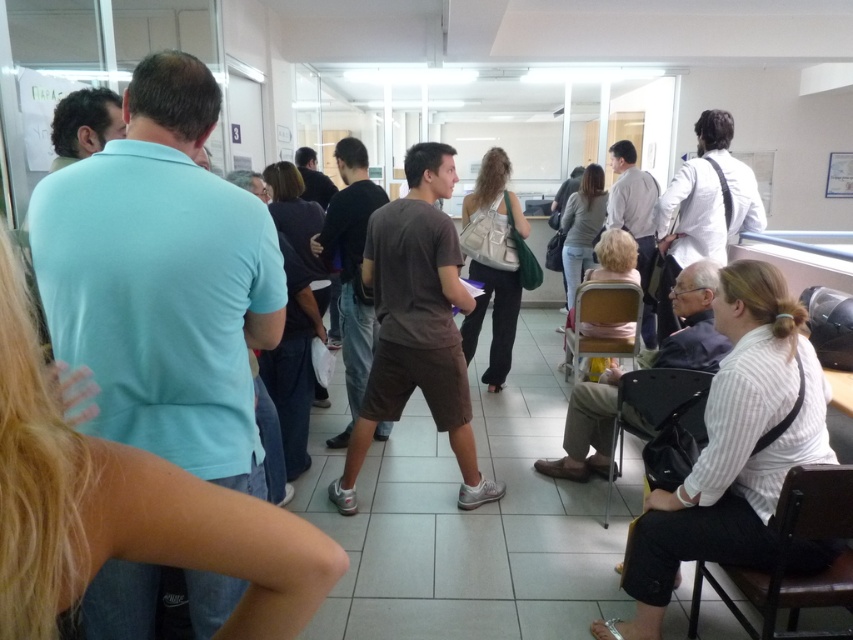
Who is higher up, white striped shirt at lower right or black fabric chair at lower right?

Positioned higher is white striped shirt at lower right.

Is white striped shirt at lower right thinner than black fabric chair at lower right?

In fact, white striped shirt at lower right might be wider than black fabric chair at lower right.

Measure the distance between white striped shirt at lower right and camera.

white striped shirt at lower right and camera are 1.75 meters apart.

The height and width of the screenshot is (640, 853). Identify the location of white striped shirt at lower right. (730, 449).

Is white striped shirt at lower right further to the viewer compared to brown wooden chair at lower right?

Yes, it is behind brown wooden chair at lower right.

Is white striped shirt at lower right taller than brown wooden chair at lower right?

Yes, white striped shirt at lower right is taller than brown wooden chair at lower right.

Image resolution: width=853 pixels, height=640 pixels. In order to click on white striped shirt at lower right in this screenshot , I will do `click(730, 449)`.

Where is `white striped shirt at lower right`? white striped shirt at lower right is located at coordinates tap(730, 449).

Identify the location of black fabric chair at lower right. This screenshot has height=640, width=853. (653, 397).

Is point (607, 492) farther from camera compared to point (601, 305)?

No, it is not.

Describe the element at coordinates (653, 397) in the screenshot. I see `black fabric chair at lower right` at that location.

Identify the location of black fabric chair at lower right. pos(653,397).